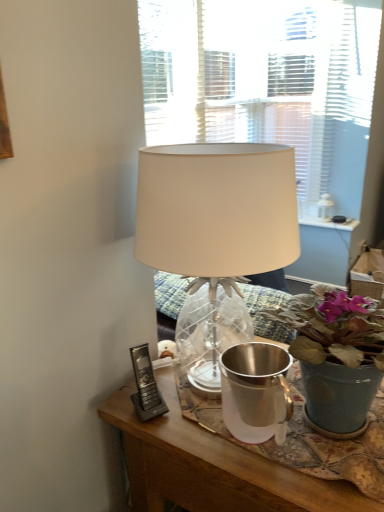
What do you see at coordinates (146, 386) in the screenshot? The image size is (384, 512). I see `black plastic phone at lower left` at bounding box center [146, 386].

What do you see at coordinates (336, 354) in the screenshot?
I see `matte gray pot at center` at bounding box center [336, 354].

Based on the photo, in order to face silver metallic watering can at center, should I rotate leftwards or rightwards?

To align with it, rotate right about 8.541°.

I want to click on white fabric lampshade at center, so click(216, 210).

Is white fabric lampshade at center facing away from silver metallic watering can at center?

No.

Does white fabric lampshade at center have a greater width compared to silver metallic watering can at center?

Correct, the width of white fabric lampshade at center exceeds that of silver metallic watering can at center.

Based on the photo, from a real-world perspective, who is located higher, white fabric lampshade at center or silver metallic watering can at center?

white fabric lampshade at center.

Is matte gray pot at center positioned with its back to silver metallic watering can at center?

matte gray pot at center does not have its back to silver metallic watering can at center.

From the image's perspective, does matte gray pot at center appear higher than silver metallic watering can at center?

Yes, from the image's perspective, matte gray pot at center is over silver metallic watering can at center.

Looking at this image, between matte gray pot at center and silver metallic watering can at center, which one has larger size?

With larger size is matte gray pot at center.

From the image's perspective, between white fabric lampshade at center and black plastic phone at lower left, which one is located above?

white fabric lampshade at center.

Is point (245, 269) behind point (137, 386)?

No, (245, 269) is in front of (137, 386).

Is white fabric lampshade at center not inside black plastic phone at lower left?

That's correct, white fabric lampshade at center is outside of black plastic phone at lower left.

Who is taller, white fabric lampshade at center or black plastic phone at lower left?

Standing taller between the two is white fabric lampshade at center.

Considering the relative sizes of matte gray pot at center and white fabric lampshade at center in the image provided, is matte gray pot at center wider than white fabric lampshade at center?

Incorrect, the width of matte gray pot at center does not surpass that of white fabric lampshade at center.

Which of these two, matte gray pot at center or white fabric lampshade at center, stands taller?

white fabric lampshade at center is taller.

Is matte gray pot at center smaller than white fabric lampshade at center?

Yes, matte gray pot at center is smaller than white fabric lampshade at center.

Find the location of a particular element. gadget behind the silver metallic watering can at center is located at coordinates (146, 386).

Considering the sizes of objects silver metallic watering can at center and black plastic phone at lower left in the image provided, who is taller, silver metallic watering can at center or black plastic phone at lower left?

With more height is silver metallic watering can at center.

Is silver metallic watering can at center not inside black plastic phone at lower left?

That's correct, silver metallic watering can at center is outside of black plastic phone at lower left.

From a real-world perspective, is silver metallic watering can at center positioned under black plastic phone at lower left based on gravity?

No, from a real-world perspective, silver metallic watering can at center is not below black plastic phone at lower left.

Which of these two, silver metallic watering can at center or white fabric lampshade at center, is wider?

Wider between the two is white fabric lampshade at center.

Considering the relative positions of silver metallic watering can at center and white fabric lampshade at center in the image provided, is silver metallic watering can at center to the right of white fabric lampshade at center from the viewer's perspective?

Yes, silver metallic watering can at center is to the right of white fabric lampshade at center.

Is silver metallic watering can at center next to white fabric lampshade at center?

No, silver metallic watering can at center is not making contact with white fabric lampshade at center.

You are a GUI agent. You are given a task and a screenshot of the screen. Output one action in this format:
    pyautogui.click(x=<x>, y=<y>)
    Task: Click on the lamp that appears in front of the silver metallic watering can at center
    
    Given the screenshot: What is the action you would take?
    pyautogui.click(x=216, y=210)

Is black plastic phone at lower left far away from matte gray pot at center?

No, black plastic phone at lower left is not far away from matte gray pot at center.

From a real-world perspective, which object rests below the other?

black plastic phone at lower left, from a real-world perspective.

Is black plastic phone at lower left facing towards matte gray pot at center?

No, black plastic phone at lower left does not turn towards matte gray pot at center.

Identify the location of lamp in front of the silver metallic watering can at center. (216, 210).

Identify the location of houseplant on the right of silver metallic watering can at center. The width and height of the screenshot is (384, 512). (336, 354).

When comparing their distances from matte gray pot at center, does silver metallic watering can at center or white fabric lampshade at center seem further?

The object further to matte gray pot at center is white fabric lampshade at center.

Looking at the image, which one is located further to silver metallic watering can at center, matte gray pot at center or white fabric lampshade at center?

white fabric lampshade at center is positioned further to the anchor silver metallic watering can at center.

Based on their spatial positions, is white fabric lampshade at center or silver metallic watering can at center further from matte gray pot at center?

white fabric lampshade at center is further to matte gray pot at center.

When comparing their distances from silver metallic watering can at center, does white fabric lampshade at center or matte gray pot at center seem closer?

matte gray pot at center lies closer to silver metallic watering can at center than the other object.

From the picture: Looking at the image, which one is located closer to black plastic phone at lower left, matte gray pot at center or silver metallic watering can at center?

The object closer to black plastic phone at lower left is silver metallic watering can at center.

Looking at the image, which one is located closer to matte gray pot at center, black plastic phone at lower left or silver metallic watering can at center?

silver metallic watering can at center.

Looking at the image, which one is located closer to silver metallic watering can at center, black plastic phone at lower left or white fabric lampshade at center?

Among the two, black plastic phone at lower left is located nearer to silver metallic watering can at center.

Looking at the image, which one is located closer to matte gray pot at center, white fabric lampshade at center or black plastic phone at lower left?

Among the two, white fabric lampshade at center is located nearer to matte gray pot at center.

This screenshot has width=384, height=512. Find the location of `houseplant that lies between white fabric lampshade at center and silver metallic watering can at center from top to bottom`. houseplant that lies between white fabric lampshade at center and silver metallic watering can at center from top to bottom is located at coordinates 336,354.

The height and width of the screenshot is (512, 384). What are the coordinates of `gadget between white fabric lampshade at center and silver metallic watering can at center in the vertical direction` in the screenshot? It's located at (146, 386).

Where is `watering can between black plastic phone at lower left and matte gray pot at center from left to right`? The width and height of the screenshot is (384, 512). watering can between black plastic phone at lower left and matte gray pot at center from left to right is located at coordinates (255, 390).

Identify the location of lamp between black plastic phone at lower left and matte gray pot at center in the horizontal direction. (216, 210).